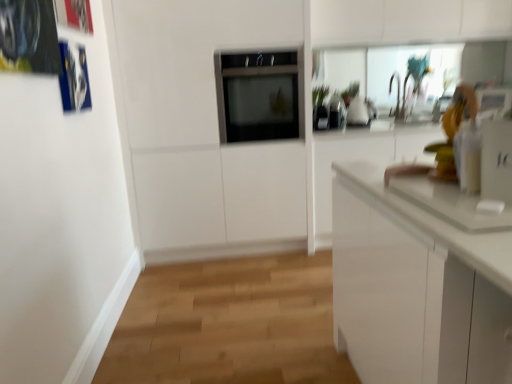
This screenshot has width=512, height=384. Identify the location of vacant space that is to the left of white glossy soap dispenser at right. (454, 201).